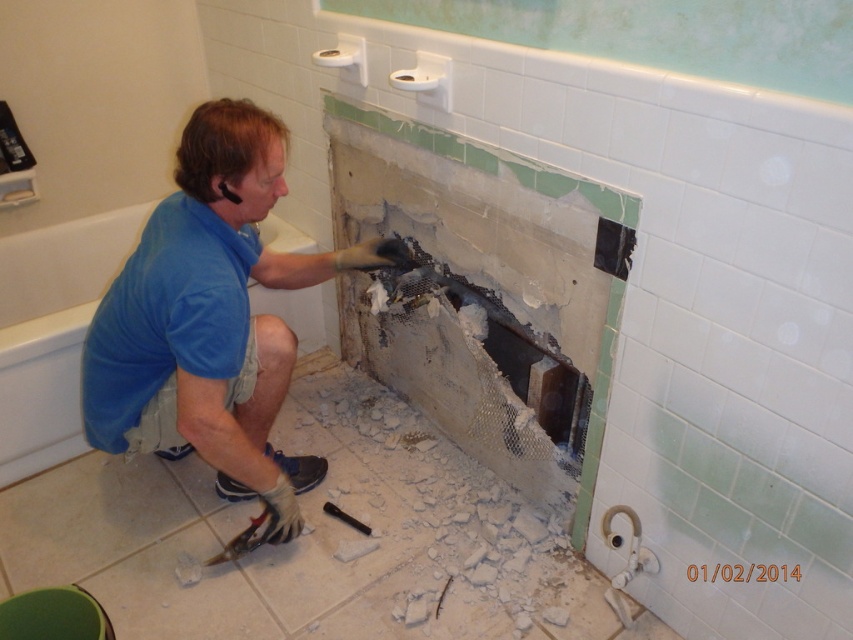
Question: Can you confirm if blue fabric shirt at center is positioned to the left of blue fabric shirt at lower left?

Choices:
 (A) yes
 (B) no

Answer: (B)

Question: Can you confirm if blue fabric shirt at center is positioned to the left of blue fabric shirt at lower left?

Choices:
 (A) yes
 (B) no

Answer: (B)

Question: Which point is closer to the camera?

Choices:
 (A) (200, 408)
 (B) (36, 355)

Answer: (A)

Question: Which point appears closest to the camera in this image?

Choices:
 (A) (222, 440)
 (B) (26, 280)

Answer: (A)

Question: Is blue fabric shirt at center bigger than blue fabric shirt at lower left?

Choices:
 (A) no
 (B) yes

Answer: (B)